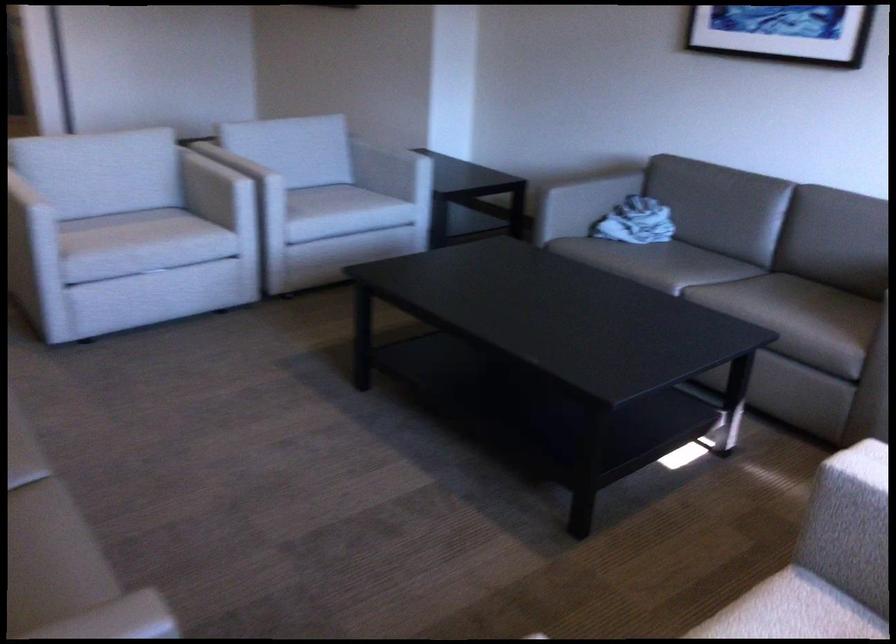
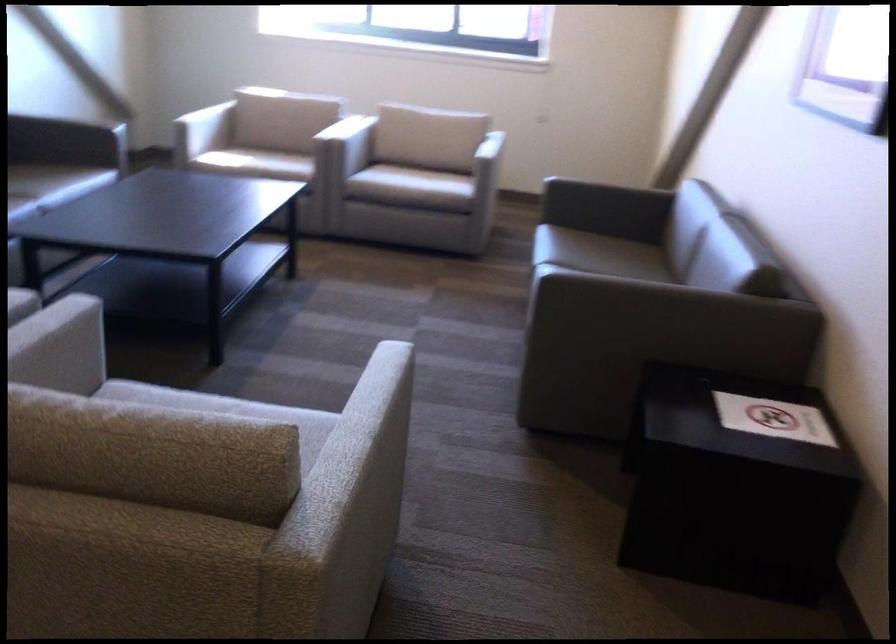
Locate, in the second image, the point that corresponds to [337,518] in the first image.

(352, 330)